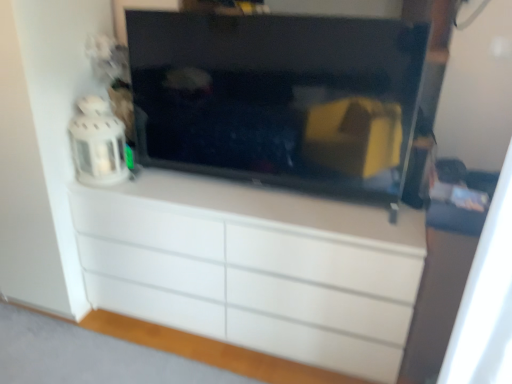
Where is `vacant space underneath black glossy tv at center (from a real-world perspective)`? This screenshot has width=512, height=384. vacant space underneath black glossy tv at center (from a real-world perspective) is located at coordinates (266, 192).